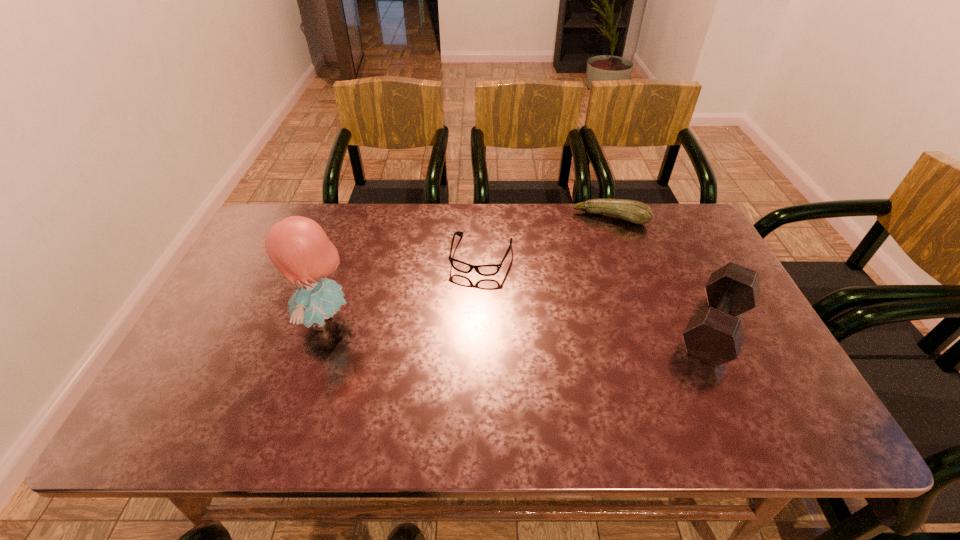
At what (x,y) coordinates should I click in order to perform the action: click on dumbbell that is at the right edge. Please return your answer as a coordinate pair (x, y). Looking at the image, I should click on (714, 335).

Identify the location of zucchini located at the right edge. (636, 212).

Locate an element on the screen. The height and width of the screenshot is (540, 960). object that is at the far right corner is located at coordinates (636, 212).

I want to click on object positioned at the near right corner, so click(x=714, y=335).

Locate an element on the screen. vacant region at the far edge of the desktop is located at coordinates (416, 221).

The image size is (960, 540). Find the location of `vacant space at the near edge of the desktop`. vacant space at the near edge of the desktop is located at coordinates (257, 372).

In the image, there is a desktop. Where is `vacant space at the left edge`? The image size is (960, 540). vacant space at the left edge is located at coordinates (262, 296).

At what (x,y) coordinates should I click in order to perform the action: click on vacant area at the right edge of the desktop. Please return your answer as a coordinate pair (x, y). This screenshot has height=540, width=960. Looking at the image, I should click on (749, 335).

The height and width of the screenshot is (540, 960). In the image, there is a desktop. Find the location of `vacant region at the near left corner`. vacant region at the near left corner is located at coordinates (179, 388).

In order to click on free space at the far right corner in this screenshot , I will do `click(657, 207)`.